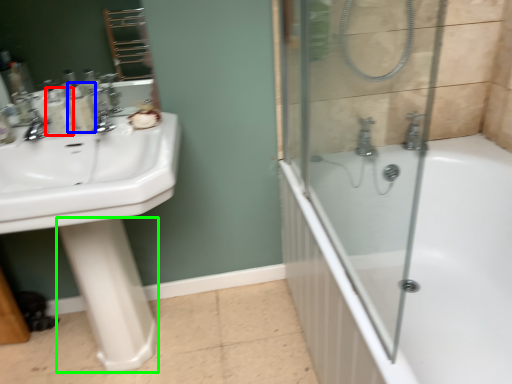
Question: Based on their relative distances, which object is nearer to toiletry (highlighted by a red box)? Choose from toiletry (highlighted by a blue box) and bidet (highlighted by a green box).

Choices:
 (A) toiletry
 (B) bidet

Answer: (A)